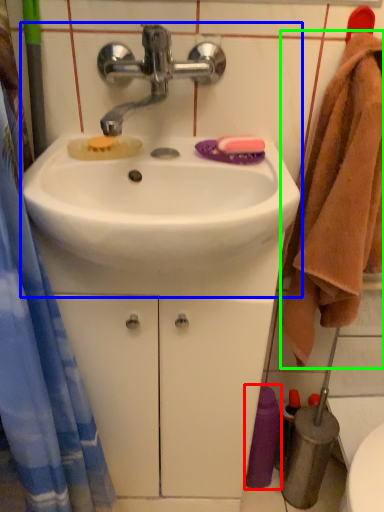
Question: Based on their relative distances, which object is nearer to toiletry (highlighted by a red box)? Choose from sink (highlighted by a blue box) and bath towel (highlighted by a green box).

Choices:
 (A) sink
 (B) bath towel

Answer: (B)